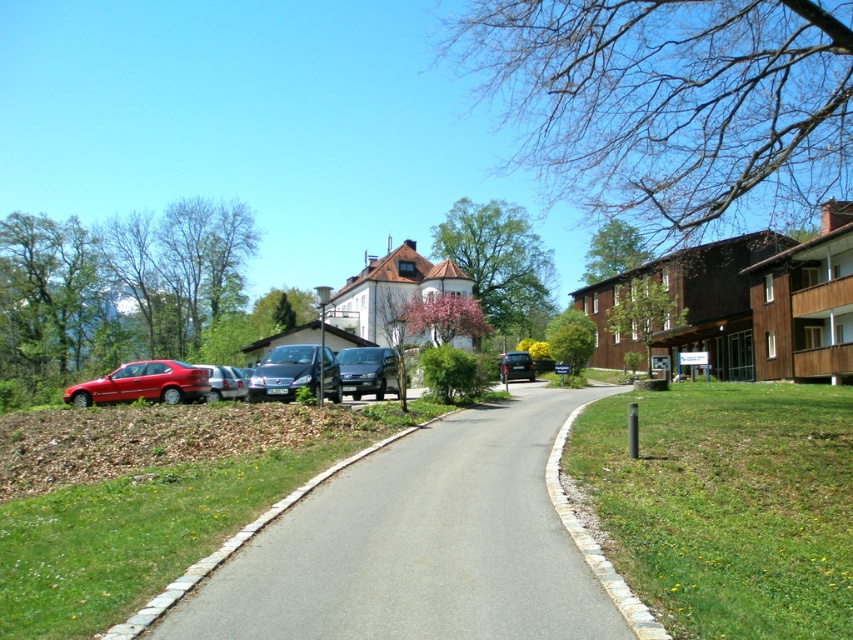
You are standing at the center of the paved road in the suburban scene. You need to find the metallic silver sedan at left. According to the coordinates provided, where exactly is it positioned relative to your current location?

The metallic silver sedan at left is located at coordinates point (224, 381), which places it to the left and slightly forward from your current position at the center of the road.

You are a delivery driver who needs to park your 15 feet long truck between the metallic silver sedan at left and the metallic silver sedan at center. Can you fit your truck there without overlapping either vehicle?

The distance between the metallic silver sedan at left and the metallic silver sedan at center is 52.28 feet. Since your truck is 15 feet long, there is sufficient space to park it between them without overlapping either vehicle.